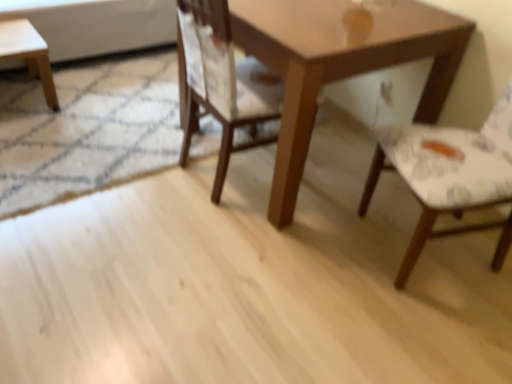
The height and width of the screenshot is (384, 512). In order to click on empty space that is in between white fabric chair at right, marked as the 2th chair in a left-to-right arrangement, and wooden table at center in this screenshot , I will do `click(346, 228)`.